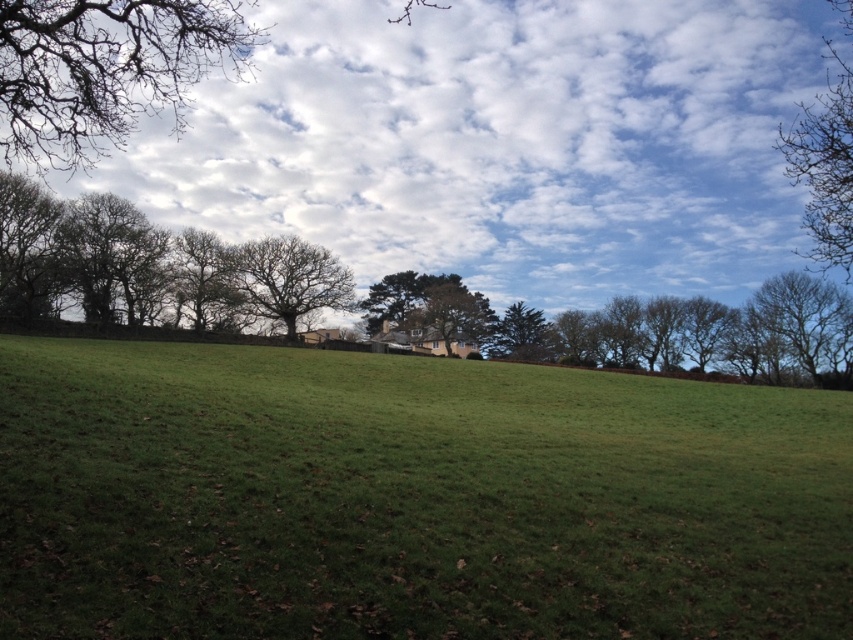
In order to click on bare branches at upper right in this screenshot , I will do `click(827, 156)`.

Is bare branches at upper right shorter than bare branches at center?

No, bare branches at upper right is not shorter than bare branches at center.

This screenshot has height=640, width=853. I want to click on bare branches at upper right, so click(x=827, y=156).

Is bare branches at right thinner than smooth bark tree at center?

No, bare branches at right is not thinner than smooth bark tree at center.

Between bare branches at right and smooth bark tree at center, which one has more height?

Standing taller between the two is bare branches at right.

Who is more distant from viewer, (828, 352) or (234, 276)?

Positioned behind is point (828, 352).

This screenshot has height=640, width=853. In order to click on bare branches at right in this screenshot , I will do `click(809, 323)`.

This screenshot has width=853, height=640. What do you see at coordinates (204, 280) in the screenshot?
I see `smooth bark tree at center` at bounding box center [204, 280].

Between point (181, 250) and point (508, 355), which one is positioned in front?

Point (181, 250) is more forward.

You are a GUI agent. You are given a task and a screenshot of the screen. Output one action in this format:
    pyautogui.click(x=<x>, y=<y>)
    Task: Click on the smooth bark tree at center
    
    Given the screenshot: What is the action you would take?
    coord(204,280)